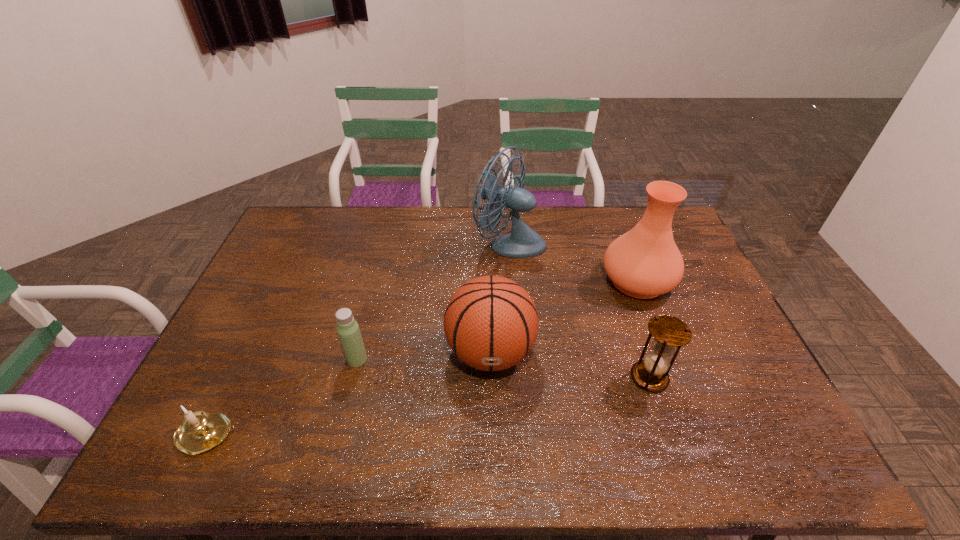
The height and width of the screenshot is (540, 960). Find the location of `vacant area that satisfies the following two spatial constraints: 1. in front of the vase to blow air; 2. on the left side of the fan`. vacant area that satisfies the following two spatial constraints: 1. in front of the vase to blow air; 2. on the left side of the fan is located at coordinates (513, 281).

Locate an element on the screen. This screenshot has width=960, height=540. blank area in the image that satisfies the following two spatial constraints: 1. on the back side of the vase; 2. on the left side of the fifth object from right to left is located at coordinates (376, 281).

The width and height of the screenshot is (960, 540). What are the coordinates of `vacant space that satisfies the following two spatial constraints: 1. in front of the vase to blow air; 2. on the right side of the fan` in the screenshot? It's located at pyautogui.click(x=513, y=281).

Where is `vacant space that satisfies the following two spatial constraints: 1. on the side where the inflation valve is located; 2. on the handle side of the candle holder`? Image resolution: width=960 pixels, height=540 pixels. vacant space that satisfies the following two spatial constraints: 1. on the side where the inflation valve is located; 2. on the handle side of the candle holder is located at coordinates (492, 435).